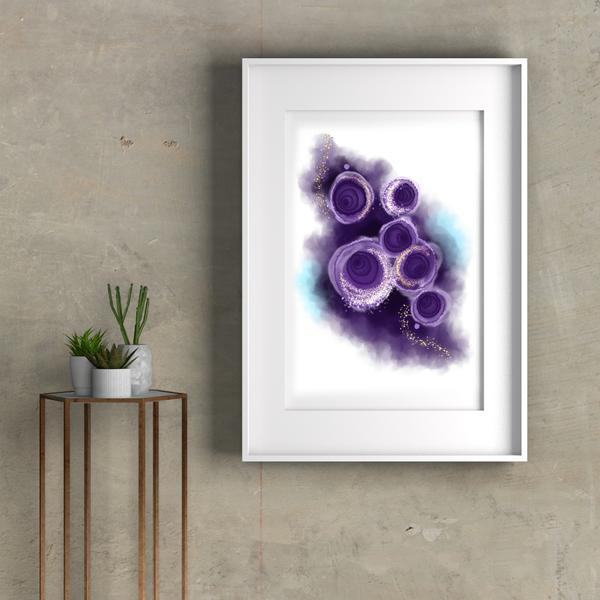
The width and height of the screenshot is (600, 600). I want to click on white pot, so tap(116, 387).